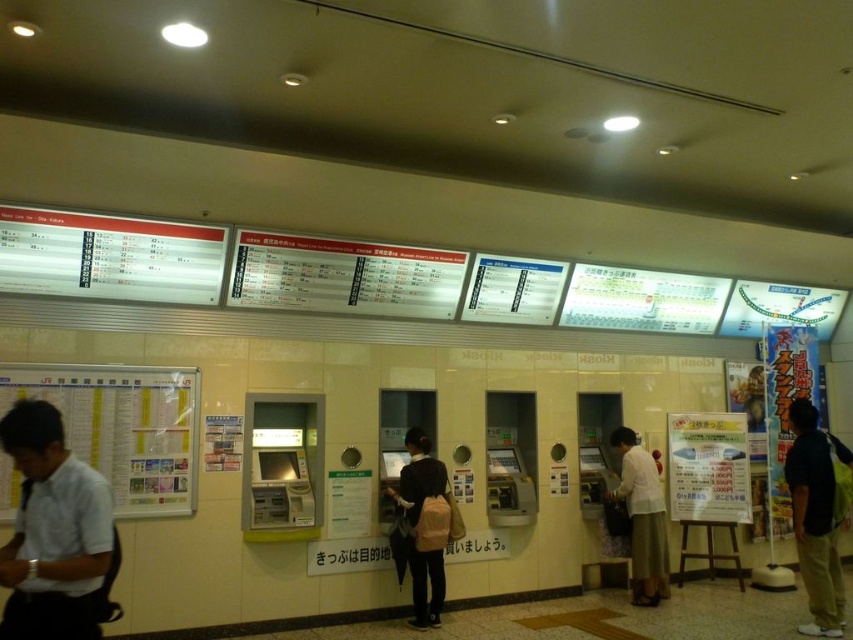
Question: Among these points, which one is nearest to the camera?

Choices:
 (A) (630, 509)
 (B) (20, 515)

Answer: (B)

Question: Which point appears closest to the camera in this image?

Choices:
 (A) (810, 560)
 (B) (410, 497)
 (C) (94, 588)

Answer: (C)

Question: Observing the image, what is the correct spatial positioning of black matte backpack at center in reference to light beige skirt at center?

Choices:
 (A) left
 (B) right

Answer: (A)

Question: Can you confirm if white shirt at left is wider than black matte backpack at center?

Choices:
 (A) yes
 (B) no

Answer: (B)

Question: Which of the following is the closest to the observer?

Choices:
 (A) (647, 534)
 (B) (96, 554)
 (C) (440, 481)
 (D) (828, 502)

Answer: (B)

Question: Is dark blue shirt at right above black matte backpack at center?

Choices:
 (A) no
 (B) yes

Answer: (B)